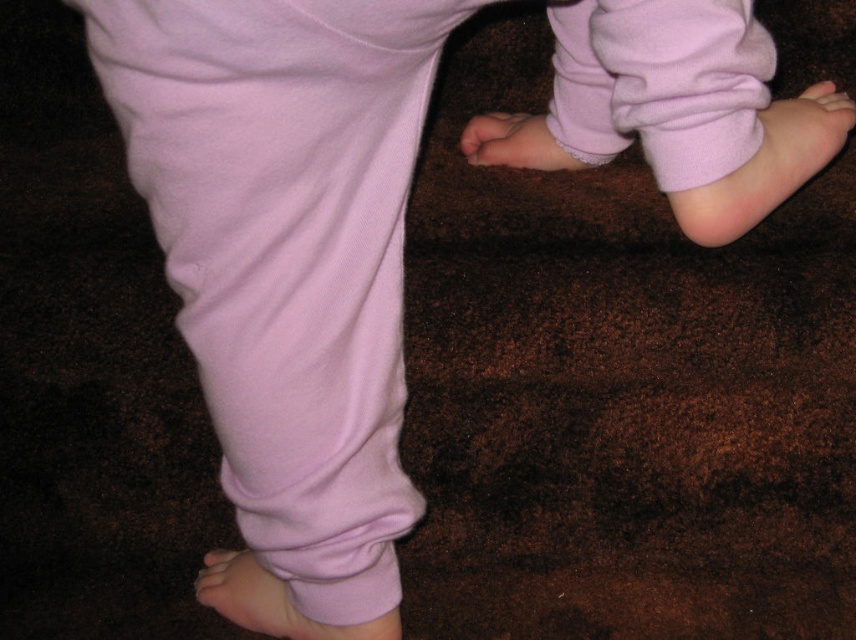
Between point (233, 612) and point (531, 124), which one is positioned behind?

The point (531, 124) is more distant.

At what (x,y) coordinates should I click in order to perform the action: click on pink soft fabric foot at lower left. Please return your answer as a coordinate pair (x, y). Looking at the image, I should click on (277, 605).

Does pink soft fabric foot at lower left appear on the right side of pink soft fabric toe at lower left?

Yes, pink soft fabric foot at lower left is to the right of pink soft fabric toe at lower left.

Is pink soft fabric foot at lower left above pink soft fabric toe at lower left?

No.

You are a GUI agent. You are given a task and a screenshot of the screen. Output one action in this format:
    pyautogui.click(x=<x>, y=<y>)
    Task: Click on the pink soft fabric foot at lower left
    The width and height of the screenshot is (856, 640).
    Given the screenshot: What is the action you would take?
    pyautogui.click(x=277, y=605)

What do you see at coordinates (514, 144) in the screenshot? I see `pink soft fabric foot at center` at bounding box center [514, 144].

Is pink soft fabric foot at center thinner than pink soft fabric toe at lower left?

In fact, pink soft fabric foot at center might be wider than pink soft fabric toe at lower left.

Which is behind, point (514, 136) or point (223, 550)?

The point (514, 136) is behind.

This screenshot has width=856, height=640. I want to click on pink soft fabric foot at center, so click(514, 144).